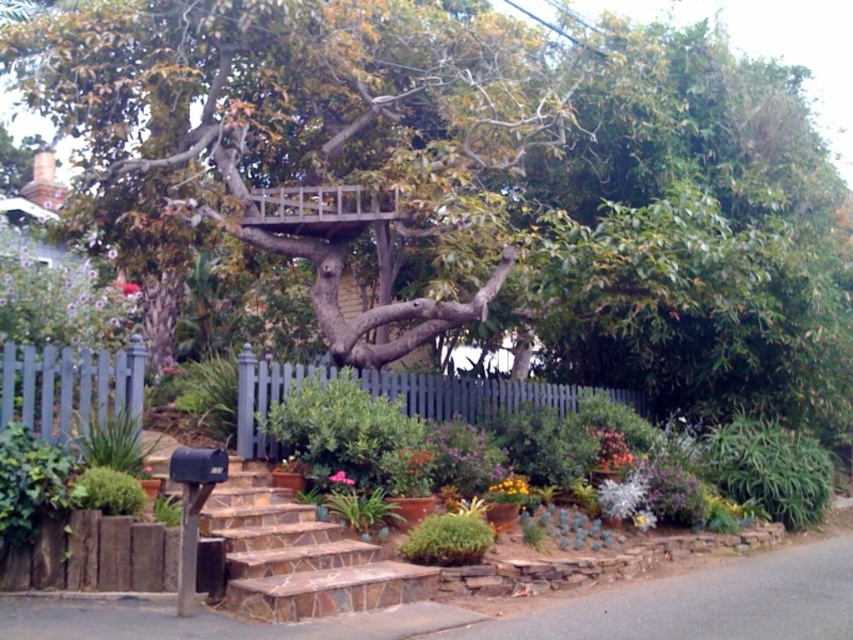
Can you confirm if blue picket fence at left is shorter than pink matte flower at center?

No.

Between point (41, 365) and point (347, 477), which one is positioned in front?

Positioned in front is point (41, 365).

Locate an element on the screen. blue picket fence at left is located at coordinates (68, 387).

Where is `blue picket fence at left`? This screenshot has height=640, width=853. blue picket fence at left is located at coordinates (68, 387).

Can you confirm if blue picket fence at left is thinner than yellow matte flower at center?

In fact, blue picket fence at left might be wider than yellow matte flower at center.

You are a GUI agent. You are given a task and a screenshot of the screen. Output one action in this format:
    pyautogui.click(x=<x>, y=<y>)
    Task: Click on the blue picket fence at left
    
    Given the screenshot: What is the action you would take?
    pyautogui.click(x=68, y=387)

Identify the location of blue picket fence at left. (68, 387).

Does brown wooden treehouse at upper center appear under gray wood fence at center?

No, brown wooden treehouse at upper center is not below gray wood fence at center.

What do you see at coordinates (479, 179) in the screenshot?
I see `brown wooden treehouse at upper center` at bounding box center [479, 179].

The height and width of the screenshot is (640, 853). What do you see at coordinates (479, 179) in the screenshot? I see `brown wooden treehouse at upper center` at bounding box center [479, 179].

This screenshot has width=853, height=640. I want to click on brown wooden treehouse at upper center, so click(479, 179).